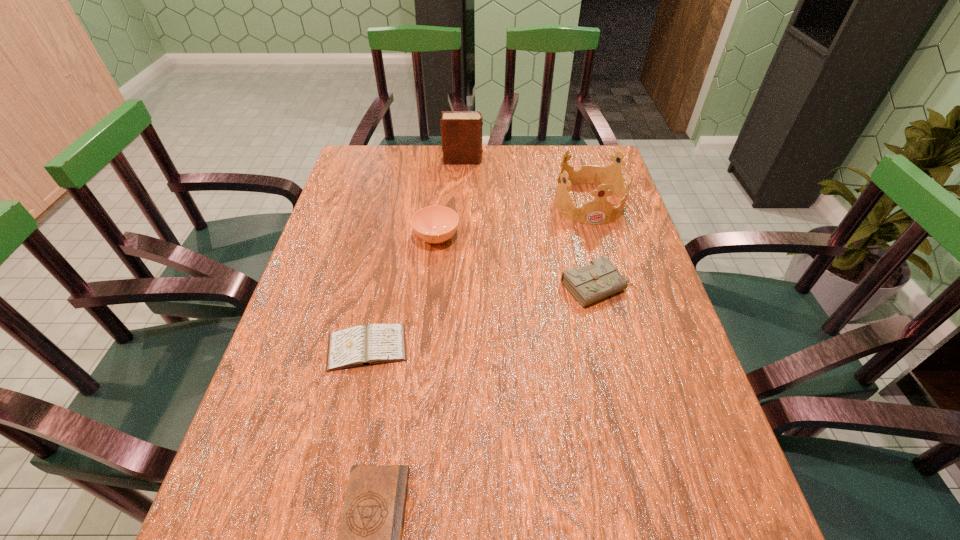
I want to click on free space located 0.220m on the front of the third shortest object, so click(x=625, y=394).

You are a GUI agent. You are given a task and a screenshot of the screen. Output one action in this format:
    pyautogui.click(x=<x>, y=<y>)
    Task: Click on the vacant space located on the front of the second nearest object
    The width and height of the screenshot is (960, 540).
    Given the screenshot: What is the action you would take?
    pyautogui.click(x=357, y=394)

Where is `diary present at the far edge`? diary present at the far edge is located at coordinates (461, 131).

The image size is (960, 540). I want to click on tiara located at the far edge, so click(610, 178).

Locate an element on the screen. object situated at the left edge is located at coordinates (362, 345).

Locate an element on the screen. The height and width of the screenshot is (540, 960). tiara that is at the right edge is located at coordinates (610, 178).

The height and width of the screenshot is (540, 960). Identify the location of diary that is positioned at the right edge. (599, 279).

Where is `object present at the far right corner`? The image size is (960, 540). object present at the far right corner is located at coordinates (610, 178).

In the image, there is a desktop. Where is `vacant space at the far edge`? The image size is (960, 540). vacant space at the far edge is located at coordinates (554, 185).

At what (x,y) coordinates should I click in order to perform the action: click on vacant space at the left edge of the desktop. Please return your answer as a coordinate pair (x, y). The height and width of the screenshot is (540, 960). Looking at the image, I should click on (340, 194).